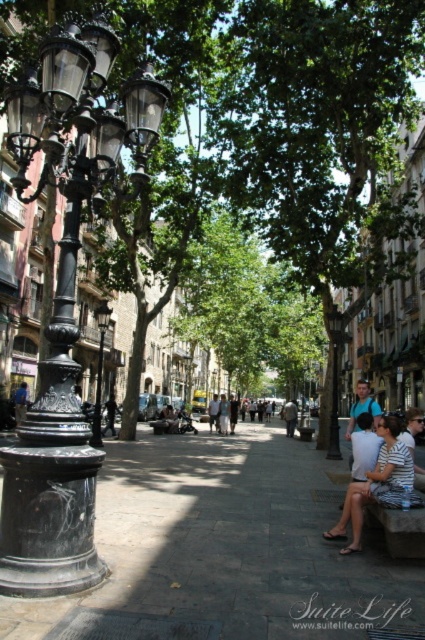
Question: Based on their relative distances, which object is nearer to the green leafy tree at center?

Choices:
 (A) black polished metal streetlamp at left
 (B) light blue denim jeans at center

Answer: (A)

Question: Observing the image, what is the correct spatial positioning of black polished metal streetlamp at left in reference to light gray fabric jacket at center?

Choices:
 (A) below
 (B) above

Answer: (B)

Question: Which point is closer to the camera?

Choices:
 (A) black polished metal streetlamp at left
 (B) light brown leather jacket at center
 (C) black metal lamp post at center

Answer: (A)

Question: Does striped fabric couple at center come behind light brown leather jacket at center?

Choices:
 (A) yes
 (B) no

Answer: (B)

Question: Can you confirm if black polished metal streetlamp at left is wider than light gray fabric jacket at center?

Choices:
 (A) no
 (B) yes

Answer: (B)

Question: Which point is closer to the camera?

Choices:
 (A) black polished metal streetlamp at left
 (B) green leafy tree at center
 (C) blue fabric shirt at center
 (D) blue denim jeans at center

Answer: (A)